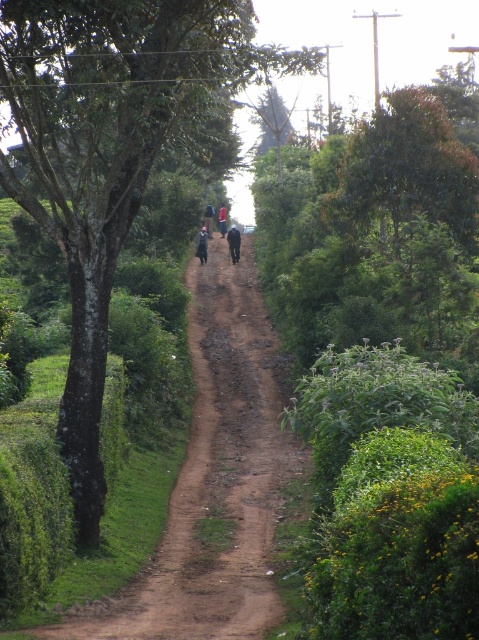
Is green leafy tree at upper right thinner than blue fabric motorcyclist at center?

Incorrect, green leafy tree at upper right's width is not less than blue fabric motorcyclist at center's.

In the scene shown: Between green leafy tree at upper right and blue fabric motorcyclist at center, which one has more height?

green leafy tree at upper right is taller.

Is point (383, 150) positioned in front of point (211, 221)?

Yes, it is in front of point (211, 221).

Locate an element on the screen. The image size is (479, 640). green leafy tree at upper right is located at coordinates (407, 172).

How far apart are green leafy tree at center and dark blue fabric at center?

A distance of 20.36 meters exists between green leafy tree at center and dark blue fabric at center.

Between point (127, 44) and point (232, 225), which one is positioned behind?

Point (232, 225)

Between point (221, 22) and point (200, 257), which one is positioned behind?

Point (200, 257)

Identify the location of green leafy tree at center. Image resolution: width=479 pixels, height=640 pixels. (109, 154).

Is dark blue fabric at center below dark blue jacket at center?

Yes, dark blue fabric at center is below dark blue jacket at center.

Which of these two, dark blue fabric at center or dark blue jacket at center, stands taller?

With more height is dark blue fabric at center.

At what (x,y) coordinates should I click in order to perform the action: click on dark blue fabric at center. Please return your answer as a coordinate pair (x, y). The width and height of the screenshot is (479, 640). Looking at the image, I should click on (234, 243).

Find the location of `dark blue fabric at center`. dark blue fabric at center is located at coordinates (234, 243).